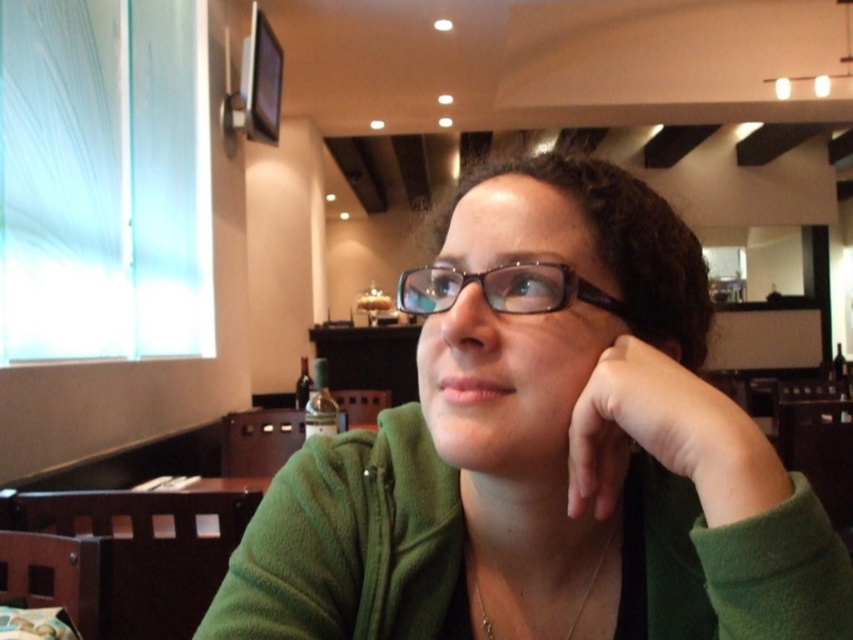
Question: Which of these objects is positioned closest to the skinny flesh-colored hand at lower right?

Choices:
 (A) green fleece jacket at center
 (B) clear plastic glasses at center

Answer: (A)

Question: Estimate the real-world distances between objects in this image. Which object is closer to the green fleece jacket at center?

Choices:
 (A) clear plastic glasses at center
 (B) skinny flesh-colored hand at lower right

Answer: (B)

Question: Which point is farther to the camera?

Choices:
 (A) green fleece jacket at center
 (B) clear plastic glasses at center
 (C) skinny flesh-colored hand at lower right

Answer: (B)

Question: Can you confirm if skinny flesh-colored hand at lower right is positioned below clear plastic glasses at center?

Choices:
 (A) yes
 (B) no

Answer: (A)

Question: In this image, where is green fleece jacket at center located relative to clear plastic glasses at center?

Choices:
 (A) above
 (B) below

Answer: (B)

Question: Is skinny flesh-colored hand at lower right positioned behind clear plastic glasses at center?

Choices:
 (A) no
 (B) yes

Answer: (A)